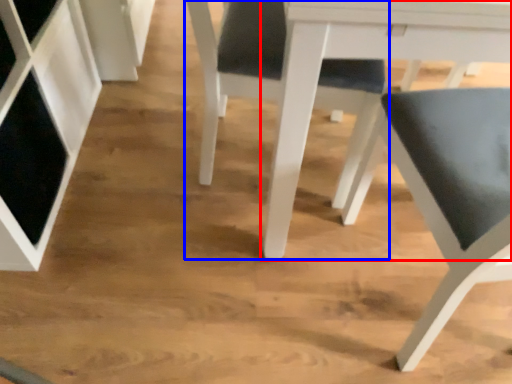
Question: Which of the following is the farthest to the observer, table (highlighted by a red box) or chair (highlighted by a blue box)?

Choices:
 (A) table
 (B) chair

Answer: (B)